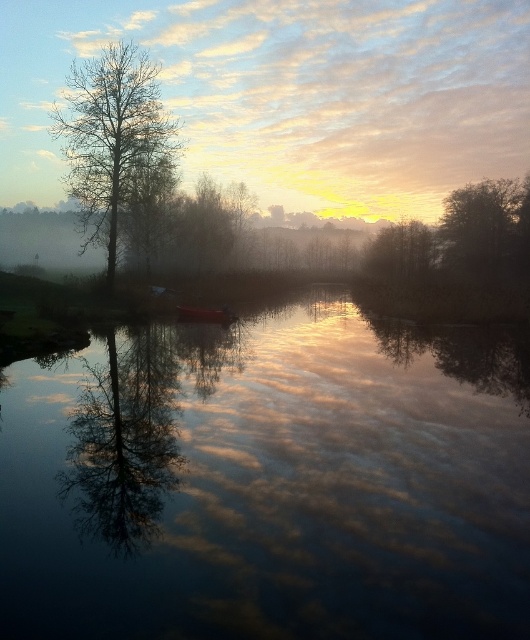
Between point (173, 163) and point (223, 308), which one is positioned behind?

Positioned behind is point (173, 163).

Measure the distance from bare branches tree at left to metallic red boat at center.

bare branches tree at left is 63.00 feet away from metallic red boat at center.

The width and height of the screenshot is (530, 640). I want to click on bare branches tree at left, so click(113, 140).

Does smooth water at center have a greater height compared to bare branches tree at left?

No, smooth water at center is not taller than bare branches tree at left.

Is smooth water at center positioned before bare branches tree at left?

Yes, smooth water at center is closer to the viewer.

Identify the location of smooth water at center. This screenshot has width=530, height=640. (269, 483).

Locate an element on the screen. This screenshot has width=530, height=640. smooth water at center is located at coordinates click(269, 483).

Can you confirm if smooth water at center is positioned to the left of smooth tree at left?

Yes, smooth water at center is to the left of smooth tree at left.

Which of these two, smooth water at center or smooth tree at left, stands shorter?

smooth water at center is shorter.

Which is behind, point (526, 470) or point (472, 172)?

Point (472, 172)

Where is `smooth water at center`? smooth water at center is located at coordinates (269, 483).